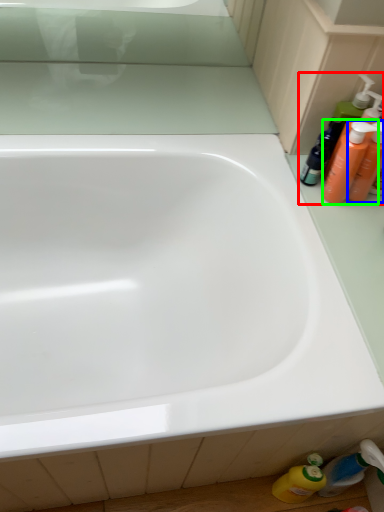
Question: Which is farther away from toiletry (highlighted by a red box)? toiletry (highlighted by a blue box) or cleaning product (highlighted by a green box)?

Choices:
 (A) toiletry
 (B) cleaning product

Answer: (A)